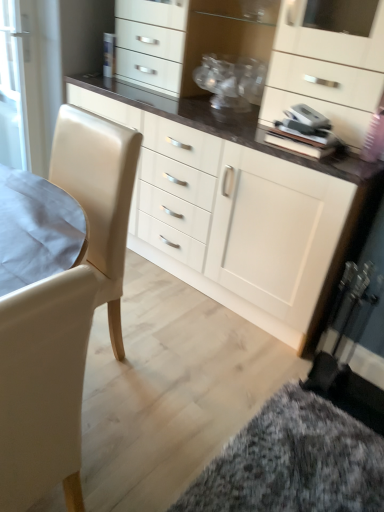
Question: From a real-world perspective, does leather-like white swivel chair at left stand above fluffy carpet at lower right?

Choices:
 (A) no
 (B) yes

Answer: (B)

Question: Is leather-like white swivel chair at left oriented away from fluffy carpet at lower right?

Choices:
 (A) no
 (B) yes

Answer: (A)

Question: Could you tell me if leather-like white swivel chair at left is facing fluffy carpet at lower right?

Choices:
 (A) no
 (B) yes

Answer: (A)

Question: Considering the relative positions of leather-like white swivel chair at left and fluffy carpet at lower right in the image provided, is leather-like white swivel chair at left to the left of fluffy carpet at lower right from the viewer's perspective?

Choices:
 (A) yes
 (B) no

Answer: (A)

Question: Is the depth of leather-like white swivel chair at left greater than that of fluffy carpet at lower right?

Choices:
 (A) yes
 (B) no

Answer: (B)

Question: Looking at their shapes, would you say fluffy carpet at lower right is wider or thinner than beige leather chair at left?

Choices:
 (A) thin
 (B) wide

Answer: (B)

Question: Considering the positions of fluffy carpet at lower right and beige leather chair at left in the image, is fluffy carpet at lower right taller or shorter than beige leather chair at left?

Choices:
 (A) short
 (B) tall

Answer: (A)

Question: Is fluffy carpet at lower right bigger or smaller than beige leather chair at left?

Choices:
 (A) big
 (B) small

Answer: (B)

Question: Would you say fluffy carpet at lower right is to the left or to the right of beige leather chair at left in the picture?

Choices:
 (A) left
 (B) right

Answer: (B)

Question: Considering the positions of matte white cabinet at center and leather-like white swivel chair at left in the image, is matte white cabinet at center taller or shorter than leather-like white swivel chair at left?

Choices:
 (A) tall
 (B) short

Answer: (A)

Question: Looking at the image, does matte white cabinet at center seem bigger or smaller compared to leather-like white swivel chair at left?

Choices:
 (A) small
 (B) big

Answer: (B)

Question: In terms of width, does matte white cabinet at center look wider or thinner when compared to leather-like white swivel chair at left?

Choices:
 (A) thin
 (B) wide

Answer: (B)

Question: Would you say matte white cabinet at center is to the left or to the right of leather-like white swivel chair at left in the picture?

Choices:
 (A) right
 (B) left

Answer: (A)

Question: From a real-world perspective, is leather-like white swivel chair at left positioned above or below fluffy carpet at lower right?

Choices:
 (A) above
 (B) below

Answer: (A)

Question: From the image's perspective, is leather-like white swivel chair at left located above or below fluffy carpet at lower right?

Choices:
 (A) above
 (B) below

Answer: (A)